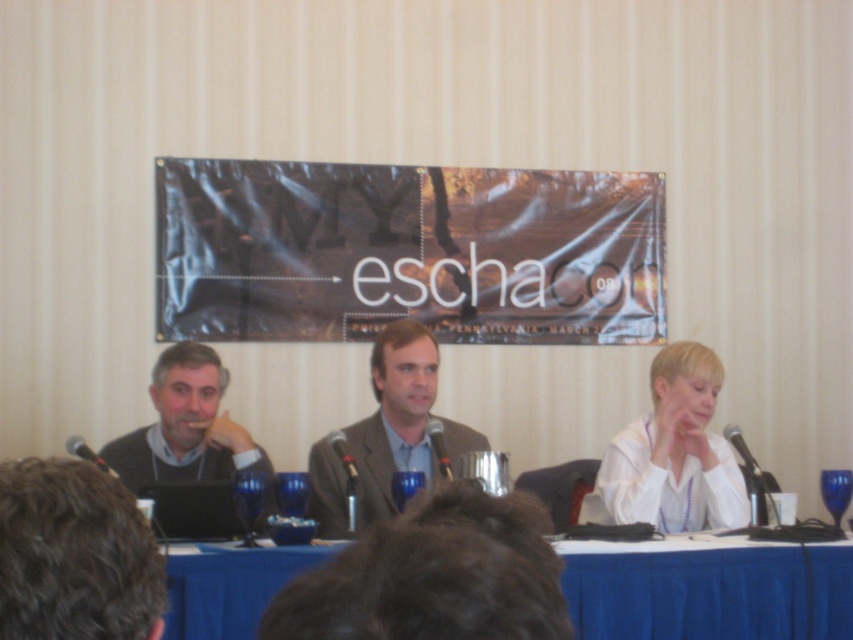
You are a photographer standing at the back of the room. You want to take a photo of the panel discussion setup. Which of the two points, point (726, 577) or point (350, 458), is closer to your camera?

Point (726, 577) is closer to the camera than point (350, 458).

You are organizing a panel discussion and need to place a name tag on the blue fabric table at center and the dark gray sweater at left. Which surface is more suitable for placing the name tag based on their sizes?

The dark gray sweater at left is larger than the blue fabric table at center, making it more suitable for placing the name tag as it provides a bigger surface area.